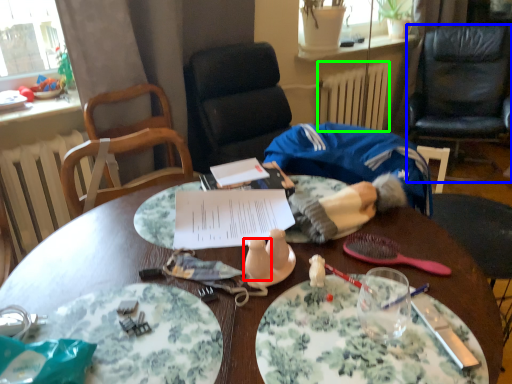
Question: Which object is positioned farthest from salt and pepper shakers (highlighted by a red box)? Select from chair (highlighted by a blue box) and radiator (highlighted by a green box).

Choices:
 (A) chair
 (B) radiator

Answer: (A)